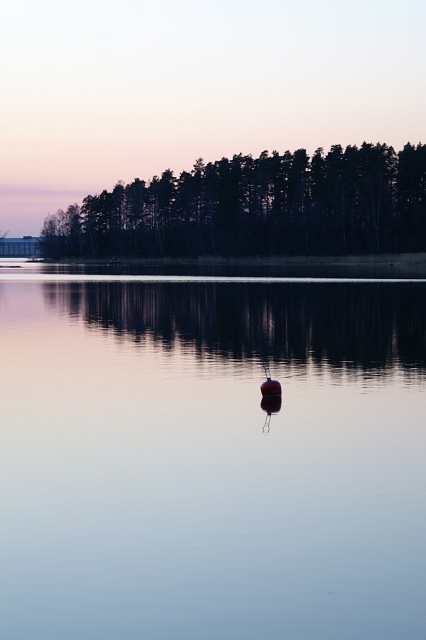
Question: From the image, what is the correct spatial relationship of smooth water at center in relation to silhouette/black trees at upper center?

Choices:
 (A) right
 (B) left

Answer: (A)

Question: From the image, what is the correct spatial relationship of silhouette/black trees at upper center in relation to smooth red buoy at center?

Choices:
 (A) left
 (B) right

Answer: (A)

Question: Which of these objects is positioned farthest from the silhouette/black trees at upper center?

Choices:
 (A) smooth water at center
 (B) smooth red buoy at center

Answer: (B)

Question: Is silhouette/black trees at upper center wider than smooth red buoy at center?

Choices:
 (A) yes
 (B) no

Answer: (A)

Question: Which point is closer to the camera taking this photo?

Choices:
 (A) (414, 408)
 (B) (365, 150)
 (C) (268, 381)

Answer: (C)

Question: Which point is farther to the camera?

Choices:
 (A) silhouette/black trees at upper center
 (B) smooth red buoy at center

Answer: (A)